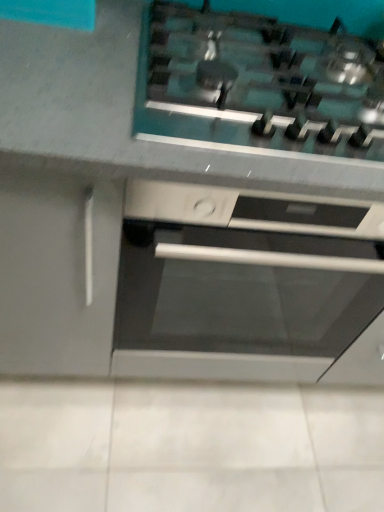
Question: Is satin steel gas stove at upper center in front of or behind satin silver oven at center in the image?

Choices:
 (A) behind
 (B) front

Answer: (B)

Question: Based on their sizes in the image, would you say satin steel gas stove at upper center is bigger or smaller than satin silver oven at center?

Choices:
 (A) big
 (B) small

Answer: (B)

Question: Is satin steel gas stove at upper center wider or thinner than satin silver oven at center?

Choices:
 (A) wide
 (B) thin

Answer: (B)

Question: In terms of height, does satin silver oven at center look taller or shorter compared to satin steel gas stove at upper center?

Choices:
 (A) tall
 (B) short

Answer: (A)

Question: In the image, is satin silver oven at center positioned in front of or behind satin steel gas stove at upper center?

Choices:
 (A) behind
 (B) front

Answer: (A)

Question: Looking at their shapes, would you say satin silver oven at center is wider or thinner than satin steel gas stove at upper center?

Choices:
 (A) thin
 (B) wide

Answer: (B)

Question: From a real-world perspective, is satin silver oven at center positioned above or below satin steel gas stove at upper center?

Choices:
 (A) above
 (B) below

Answer: (B)